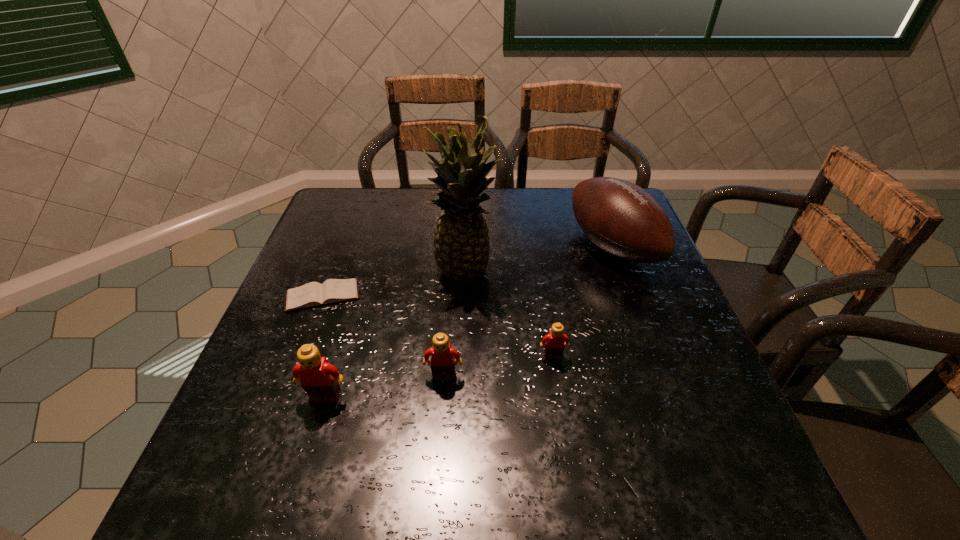
I want to click on object located in the near left corner section of the desktop, so click(x=319, y=379).

The height and width of the screenshot is (540, 960). Find the location of `object that is at the far right corner`. object that is at the far right corner is located at coordinates (622, 219).

Identify the location of free point at the far edge. The image size is (960, 540). (563, 193).

In the image, there is a desktop. Identify the location of vacant space at the near edge. (354, 423).

Locate an element on the screen. The image size is (960, 540). blank space at the left edge is located at coordinates (356, 236).

Identify the location of vacant space at the right edge of the desktop. (639, 380).

Locate an element on the screen. vacant space at the near right corner is located at coordinates (727, 416).

Find the location of a particular element. The height and width of the screenshot is (540, 960). empty space that is in between the fifth farthest object and the third tallest object is located at coordinates (385, 387).

The height and width of the screenshot is (540, 960). In order to click on vacant area between the football (American) and the third tallest object in this screenshot , I will do `click(468, 322)`.

I want to click on free point between the nearest Lego and the tallest object, so click(x=396, y=335).